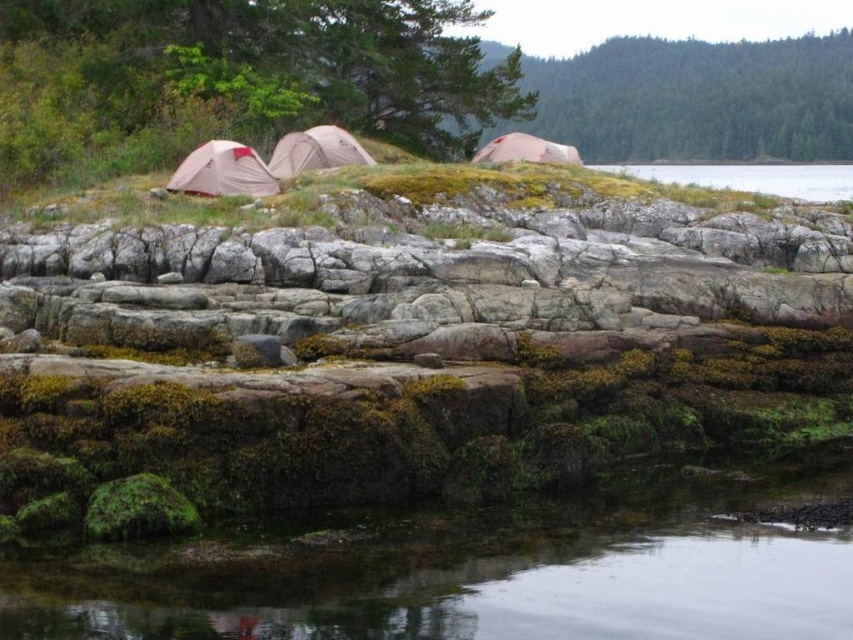
Where is the matte pink tent at left located in the image?

The matte pink tent at left is located at point (x=223, y=172).

You are a hiker who needs to fill your water bottle. You see clear water at lower right and a matte gray tent at center. Which one is bigger in size?

The clear water at lower right is larger in size than the matte gray tent at center.